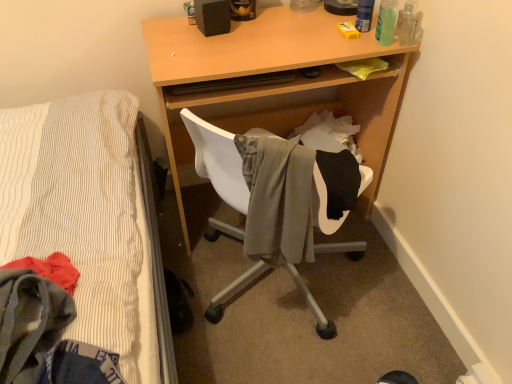
Locate an element on the screen. This screenshot has width=512, height=384. free area in between green translucent bottle at upper right, arranged as the 2th bottle when viewed from the right, and matte black speaker at upper center is located at coordinates (287, 34).